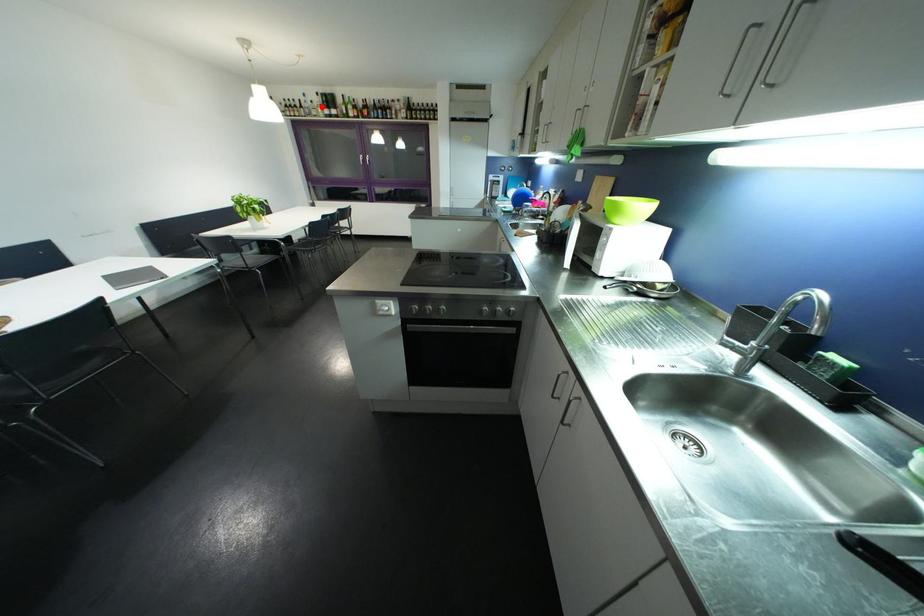
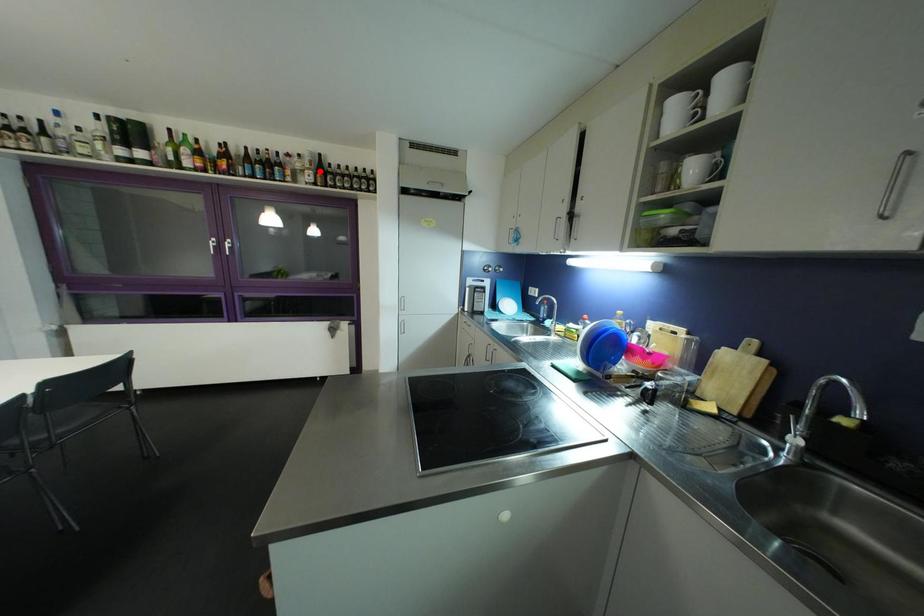
I am providing you with two images of the same scene from different viewpoints. A red point is marked on the first image and another point is marked on the second image. Is the red point in image1 aligned with the point shown in image2?

No